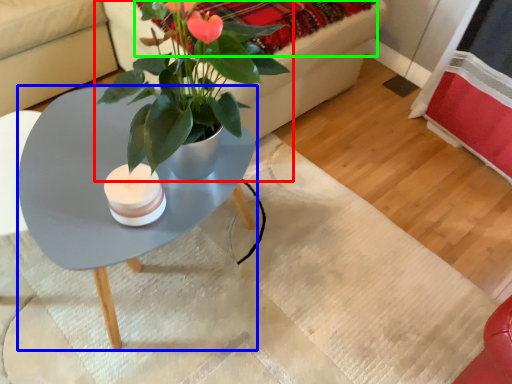
Question: Based on their relative distances, which object is nearer to houseplant (highlighted by a red box)? Choose from coffee table (highlighted by a blue box) and blanket (highlighted by a green box).

Choices:
 (A) coffee table
 (B) blanket

Answer: (B)